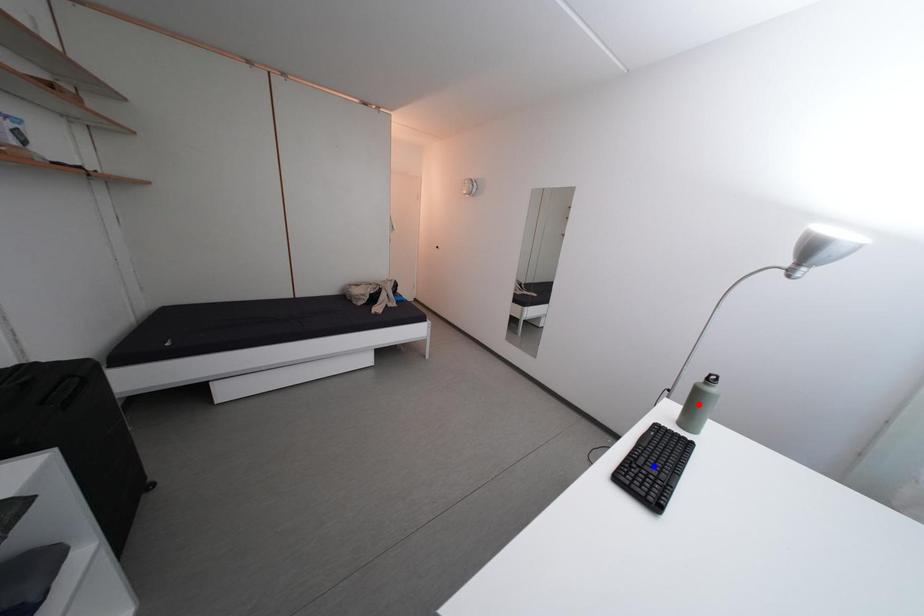
Question: In the image, two points are highlighted. Which point is nearer to the camera? Reply with the corresponding letter.

Choices:
 (A) blue point
 (B) red point

Answer: (A)